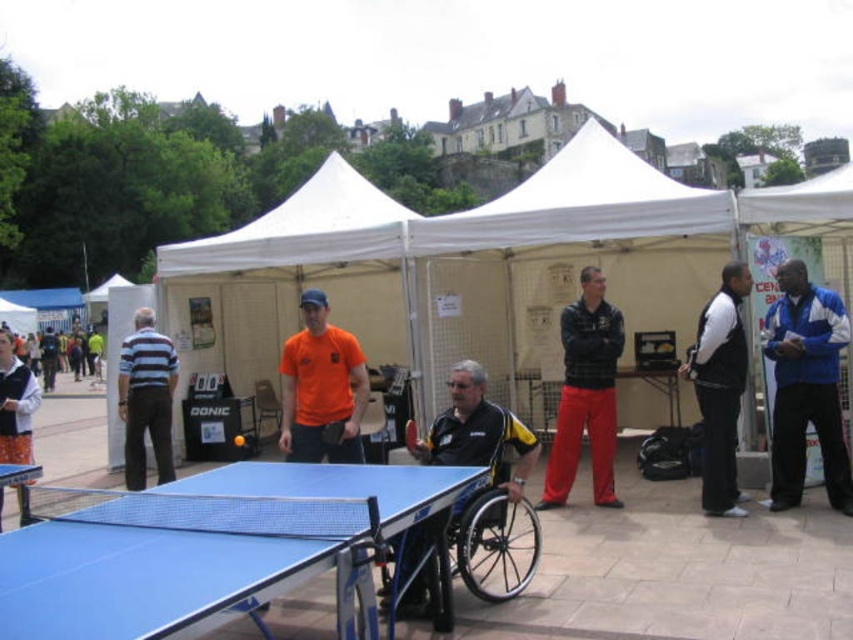
Is striped cotton shirt at left to the left of orange fabric pants at lower left from the viewer's perspective?

Incorrect, striped cotton shirt at left is not on the left side of orange fabric pants at lower left.

Which is behind, point (161, 337) or point (3, 404)?

Positioned behind is point (161, 337).

Find the location of a particular element. This screenshot has height=640, width=853. striped cotton shirt at left is located at coordinates (146, 397).

Does black plastic wheelchair at center appear on the right side of black fleece jacket at right?

No, black plastic wheelchair at center is not to the right of black fleece jacket at right.

Can you confirm if black plastic wheelchair at center is positioned to the left of black fleece jacket at right?

Correct, you'll find black plastic wheelchair at center to the left of black fleece jacket at right.

Is point (479, 509) positioned after point (726, 444)?

No.

Identify the location of black plastic wheelchair at center. The height and width of the screenshot is (640, 853). (492, 531).

Is point (831, 454) more distant than point (13, 484)?

Yes.

Is blue/white jacket at right taller than blue plastic ping pong table at lower left?

Yes.

The image size is (853, 640). Identify the location of blue/white jacket at right. (805, 387).